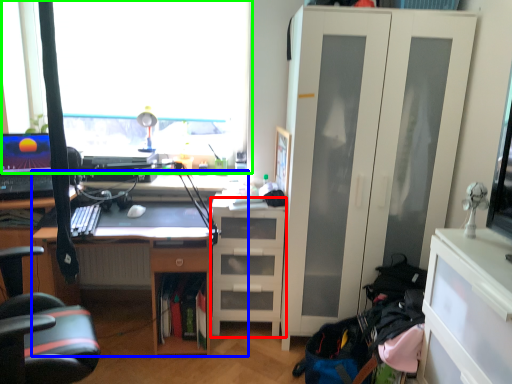
Question: Estimate the real-world distances between objects in this image. Which object is closer to shelf (highlighted by a red box), desk (highlighted by a blue box) or window (highlighted by a green box)?

Choices:
 (A) desk
 (B) window

Answer: (A)